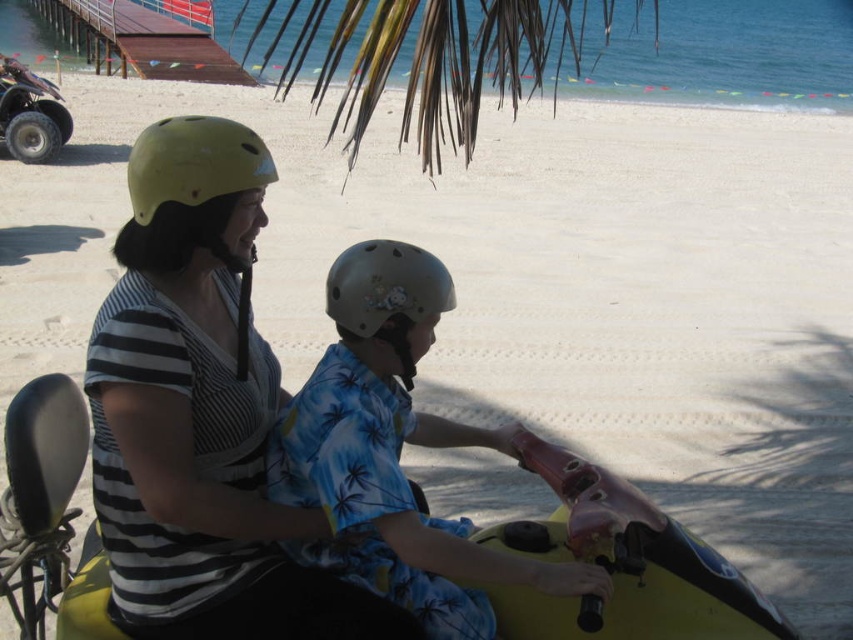
From the picture: Does green leafy palm tree at upper center have a smaller size compared to yellow matte helmet at upper left?

Incorrect, green leafy palm tree at upper center is not smaller in size than yellow matte helmet at upper left.

Looking at this image, can you confirm if green leafy palm tree at upper center is bigger than yellow matte helmet at upper left?

Correct, green leafy palm tree at upper center is larger in size than yellow matte helmet at upper left.

Who is more forward, (527, 32) or (138, 196)?

Point (138, 196)

Locate an element on the screen. This screenshot has height=640, width=853. green leafy palm tree at upper center is located at coordinates (432, 60).

Which is more to the left, blue floral shirt at center or matte olive green helmet at center?

matte olive green helmet at center is more to the left.

Is blue floral shirt at center to the right of matte olive green helmet at center from the viewer's perspective?

Indeed, blue floral shirt at center is positioned on the right side of matte olive green helmet at center.

Is point (370, 282) farther from camera compared to point (370, 275)?

No, it is in front of (370, 275).

Find the location of `blue floral shirt at center`. blue floral shirt at center is located at coordinates (393, 452).

The height and width of the screenshot is (640, 853). What do you see at coordinates (393, 452) in the screenshot?
I see `blue floral shirt at center` at bounding box center [393, 452].

Can you confirm if blue floral shirt at center is positioned above green leafy palm tree at upper center?

No.

The image size is (853, 640). Identify the location of blue floral shirt at center. (393, 452).